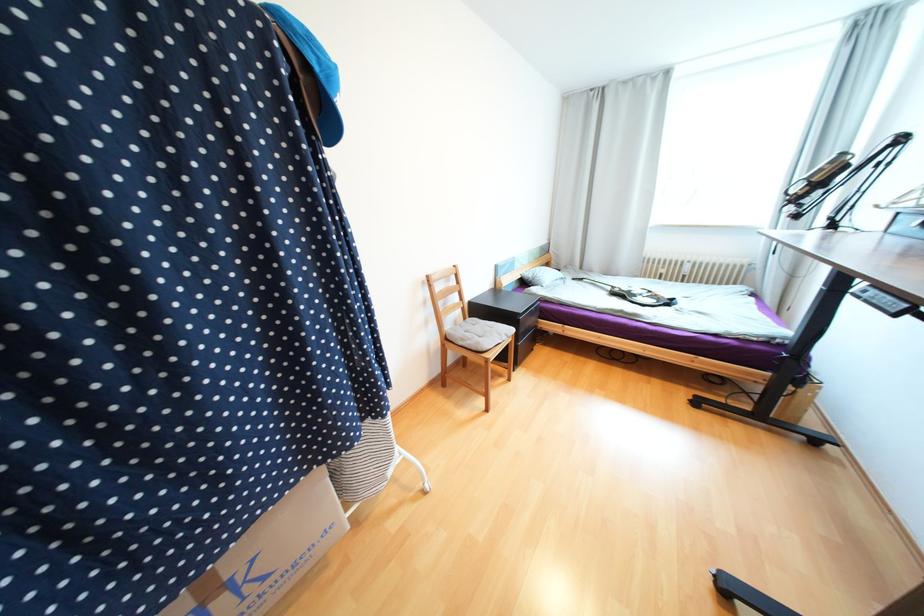
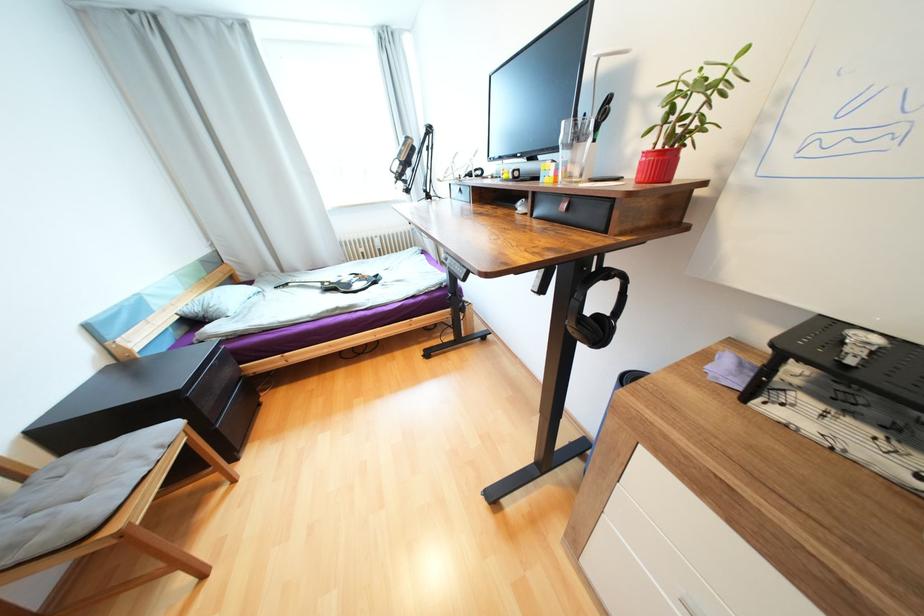
Question: The images are taken continuously from a first-person perspective. In which direction is your viewpoint rotating?

Choices:
 (A) Left
 (B) Right
 (C) Up
 (D) Down

Answer: (B)